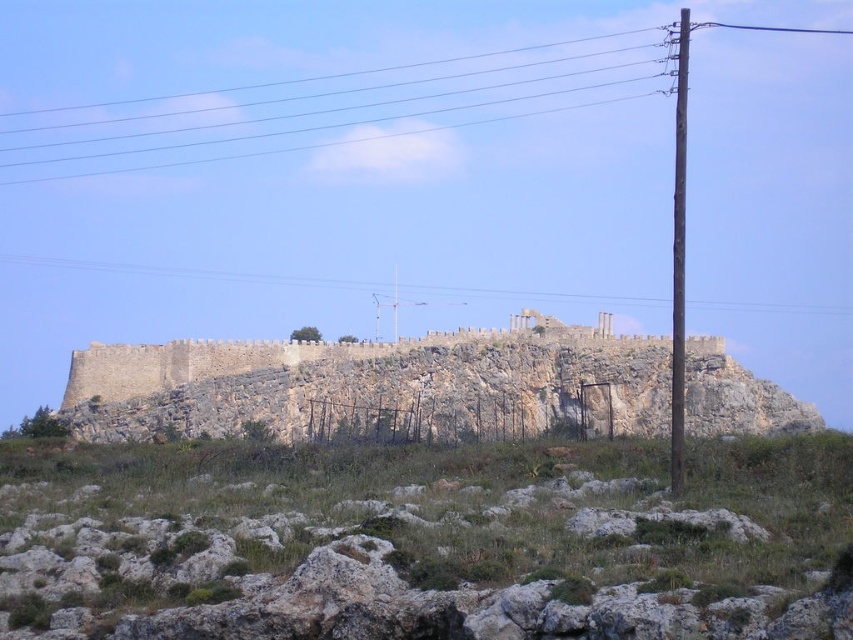
Question: Among these points, which one is farthest from the camera?

Choices:
 (A) (457, 109)
 (B) (625, 388)

Answer: (A)

Question: Does rocky terrain at center have a greater width compared to brown wooden telegraph pole at right?

Choices:
 (A) no
 (B) yes

Answer: (B)

Question: Is rustic stone wall at center closer to the viewer compared to brown wooden telegraph pole at right?

Choices:
 (A) yes
 (B) no

Answer: (B)

Question: Among these objects, which one is farthest from the camera?

Choices:
 (A) rocky terrain at center
 (B) metallic wires at upper center
 (C) metallic wire at upper center

Answer: (B)

Question: Estimate the real-world distances between objects in this image. Which object is closer to the rustic stone wall at center?

Choices:
 (A) metallic wires at upper center
 (B) rocky terrain at center
 (C) brown wooden telegraph pole at right

Answer: (C)

Question: Can you confirm if metallic wire at upper center is bigger than brown wooden telegraph pole at right?

Choices:
 (A) yes
 (B) no

Answer: (B)